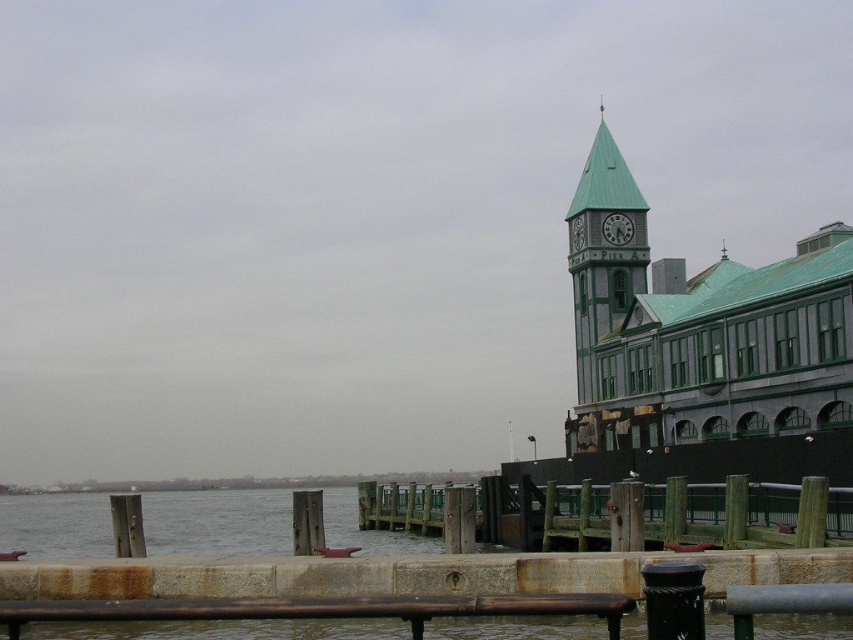
Between clear water at lower left and green wooden clock tower at upper right, which one is positioned lower?

clear water at lower left is lower down.

At what (x,y) coordinates should I click in order to perform the action: click on clear water at lower left. Please return your answer as a coordinate pair (x, y). This screenshot has width=853, height=640. Looking at the image, I should click on (218, 522).

Is rusty metal rail at lower center in front of green metallic clock tower at upper right?

Yes, it is.

Based on the photo, is the position of rusty metal rail at lower center more distant than that of green metallic clock tower at upper right?

No, rusty metal rail at lower center is in front of green metallic clock tower at upper right.

Is point (662, 634) positioned behind point (581, 227)?

No.

Where is `rusty metal rail at lower center`? rusty metal rail at lower center is located at coordinates tap(318, 609).

In the scene shown: Is green metallic clock at upper center closer to camera compared to green metallic clock tower at upper right?

No, it is not.

Between point (619, 236) and point (581, 220), which one is positioned behind?

The point (581, 220) is more distant.

Locate an element on the screen. green metallic clock at upper center is located at coordinates (618, 228).